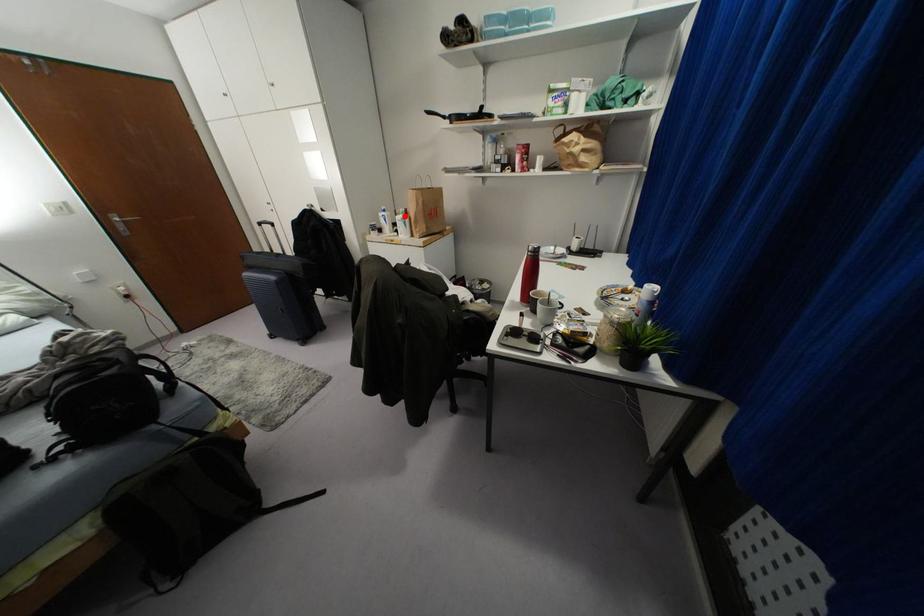
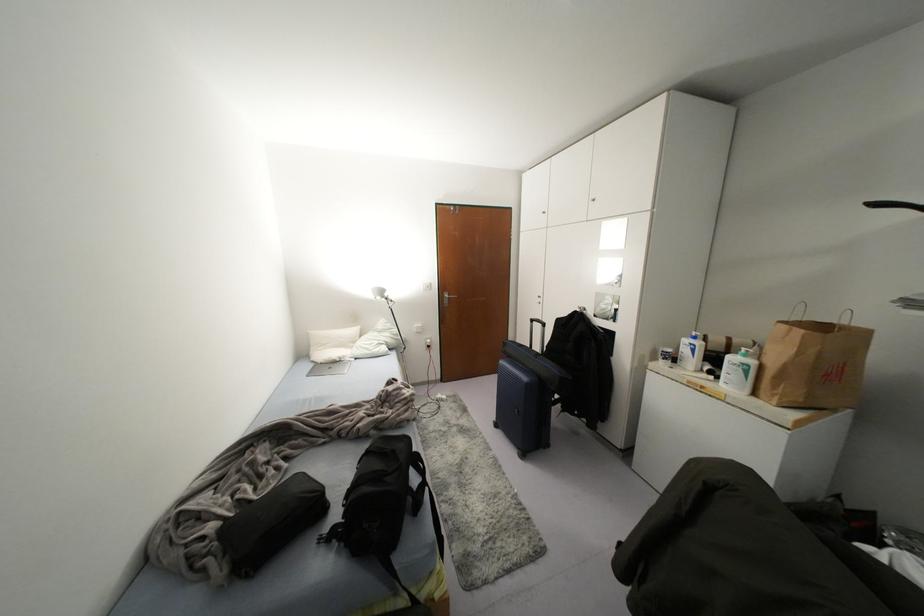
Where in the second image is the point corresponding to the highlighted location from the first image?

(751, 362)